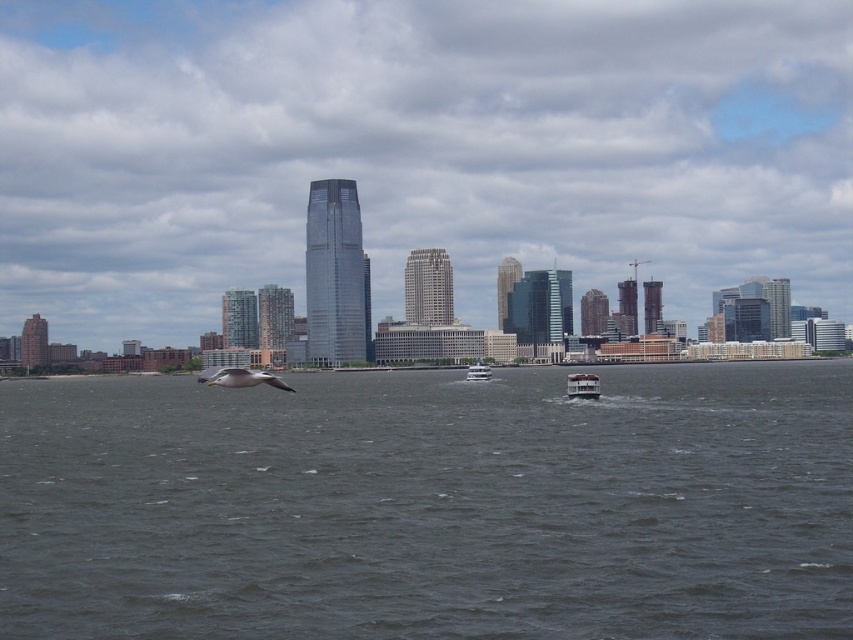
Question: Considering the relative positions of gray water at center and white glossy ferry at center in the image provided, where is gray water at center located with respect to white glossy ferry at center?

Choices:
 (A) left
 (B) right

Answer: (A)

Question: Is transparent glass skyscraper at center to the right of gray water at center from the viewer's perspective?

Choices:
 (A) yes
 (B) no

Answer: (A)

Question: Considering the relative positions of white glossy ferry at center and white glossy boat at center in the image provided, where is white glossy ferry at center located with respect to white glossy boat at center?

Choices:
 (A) below
 (B) above

Answer: (A)

Question: Which point is closer to the camera?

Choices:
 (A) white matte bird at lower left
 (B) white glossy ferry at center

Answer: (B)

Question: Which point is farther to the camera?

Choices:
 (A) gray water at center
 (B) white matte bird at lower left

Answer: (B)

Question: Which point is closer to the camera?

Choices:
 (A) white matte bird at lower left
 (B) transparent glass skyscraper at center
 (C) white glossy ferry at center

Answer: (C)